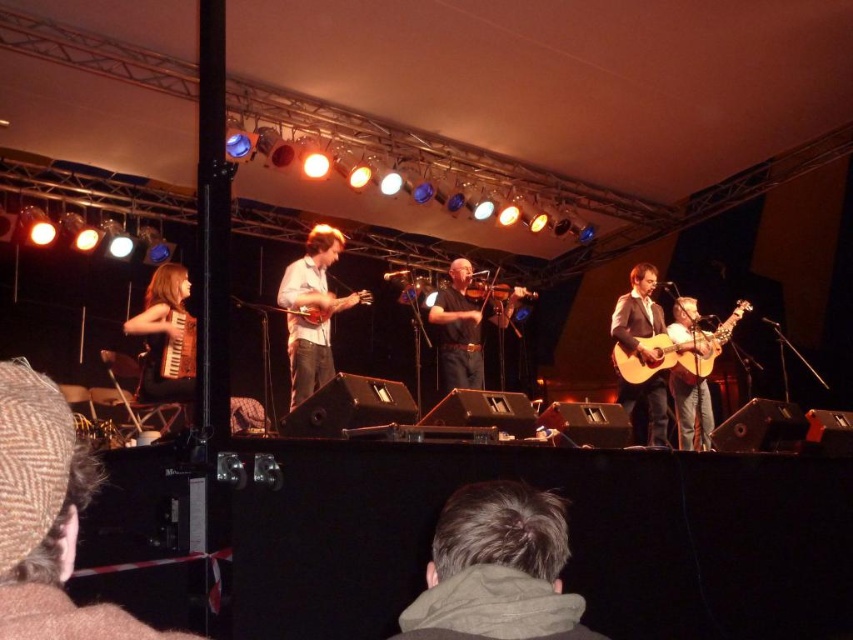
You are a stagehand who needs to place a new microphone stand between the white matte guitar at center and the matte brown acoustic guitar at center. Which guitar should the stand be placed closer to if the stand can only fit in the narrower space between them?

The stand should be placed closer to the matte brown acoustic guitar at center because it is smaller than the white matte guitar at center, creating a narrower space between them.

You are a stagehand setting up a music stand. You need to place it between the white matte guitar at center and the matte brown acoustic guitar at center. Which guitar should the stand be closer to if you want it to be closer to the taller instrument?

The white matte guitar at center is not as tall as the matte brown acoustic guitar at center, so the music stand should be closer to the matte brown acoustic guitar at center since it is taller.

You are standing at the center of the stage and want to pick up the brown woolen hat at lower left. In which direction should you move to reach it?

The brown woolen hat at lower left is located at coordinates 0.809 on the x axis and 0.056 on the y axis. Since you are at the center of the stage, you should move towards the lower left direction to reach it.